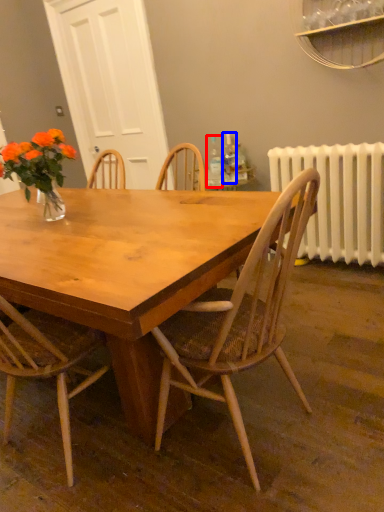
Question: Among these objects, which one is farthest to the camera, bottle (highlighted by a red box) or bottle (highlighted by a blue box)?

Choices:
 (A) bottle
 (B) bottle

Answer: (B)